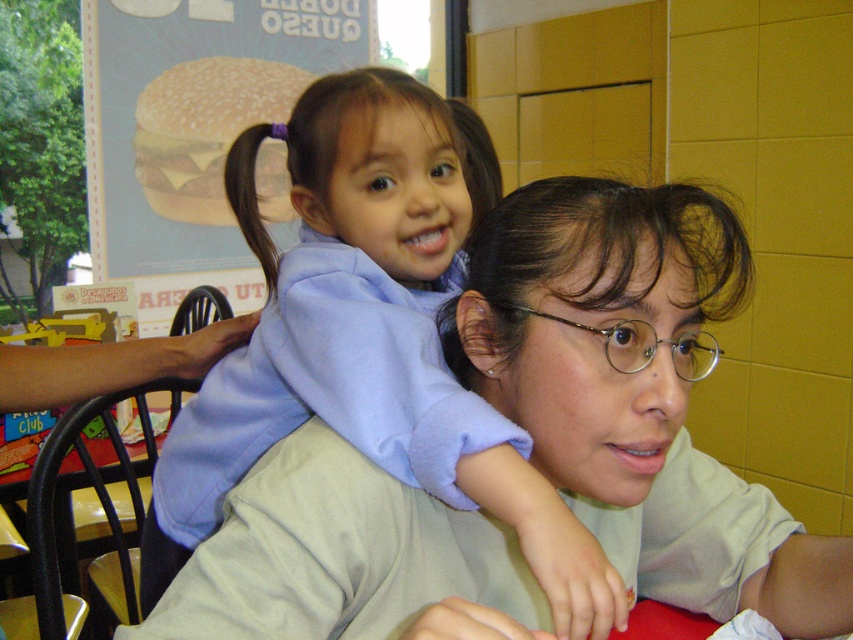
You are standing in the dining area and want to place a small decoration between the two points marked as point (422, 429) and point (230, 182). Which point should the decoration be closer to in order to appear centered from your perspective?

To appear centered from your perspective, the decoration should be closer to point (230, 182) because point (422, 429) is closer to the viewer. This adjustment balances the visual distance between the two points.

You are standing at the origin point in the image. Which of the two points, point (404, 186) or point (705, 364), is closer to you?

Point (404, 186) is in front of point (705, 364), so it is closer to you.

You are a fashion designer observing the image. You need to determine which of the two items at center is more suitable for a child to wear comfortably. Consider the size of the light blue fleece at center and metallic round glasses at center. Which item is larger and thus more appropriate for a child?

The light blue fleece at center is larger in size than the metallic round glasses at center, making it more suitable for a child to wear comfortably.